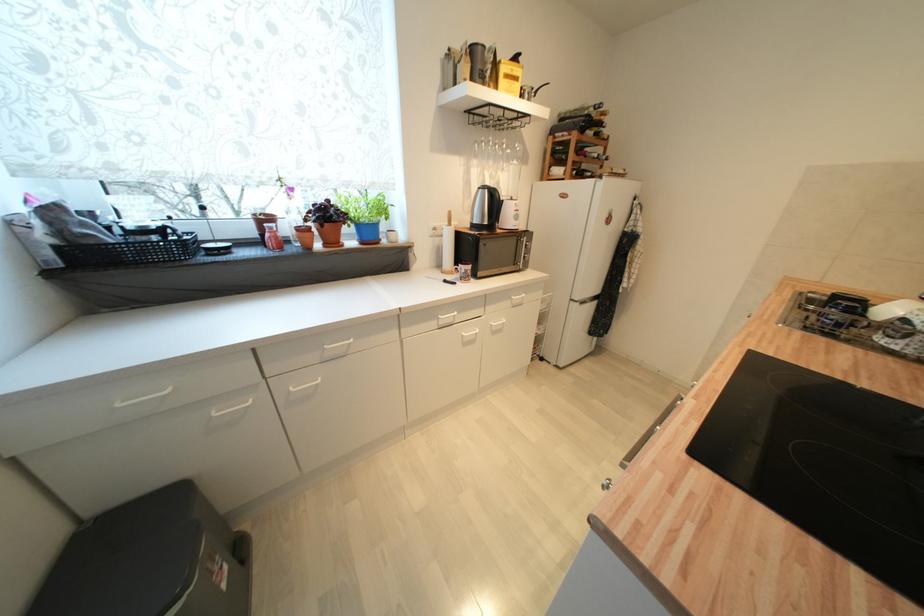
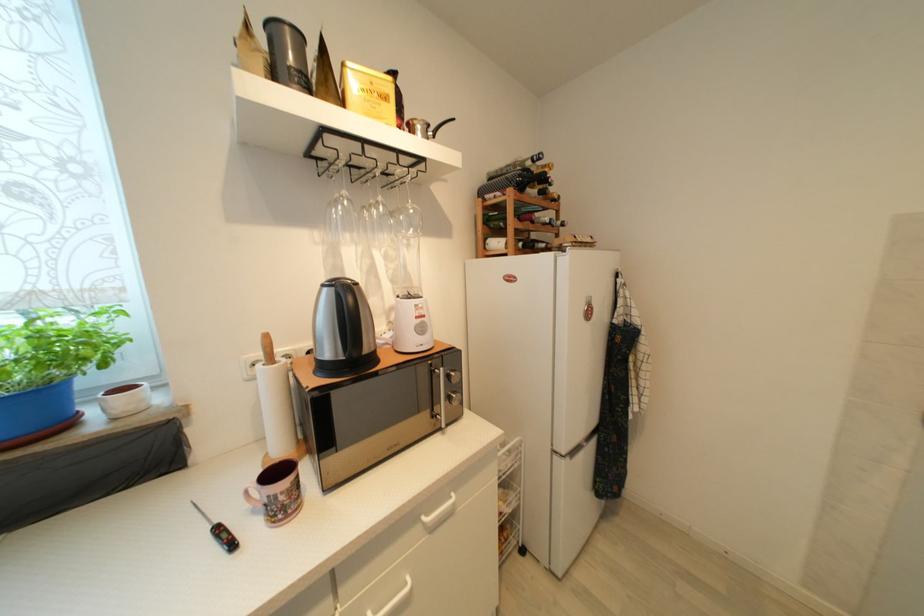
Locate, in the second image, the point that corresponds to point 529,257 in the first image.

(455, 400)